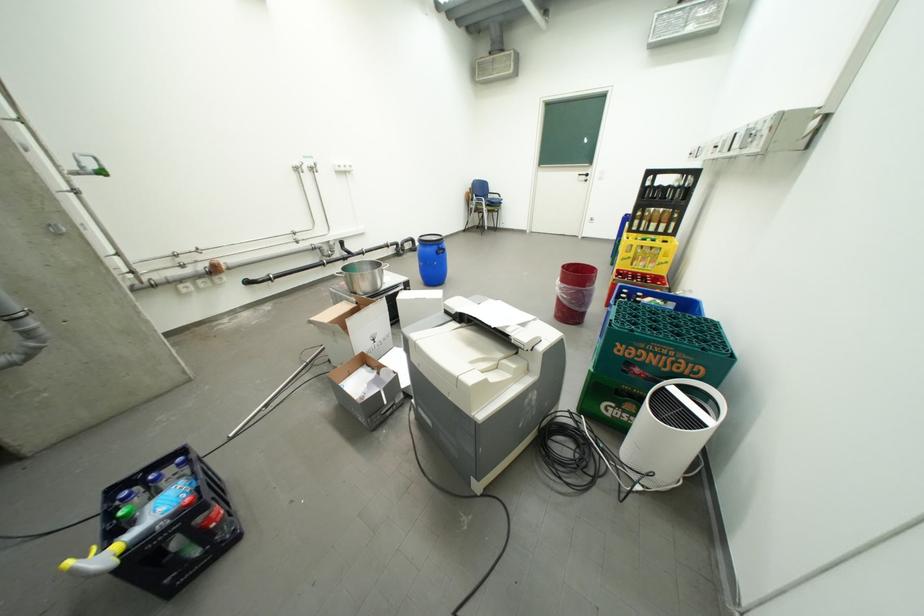
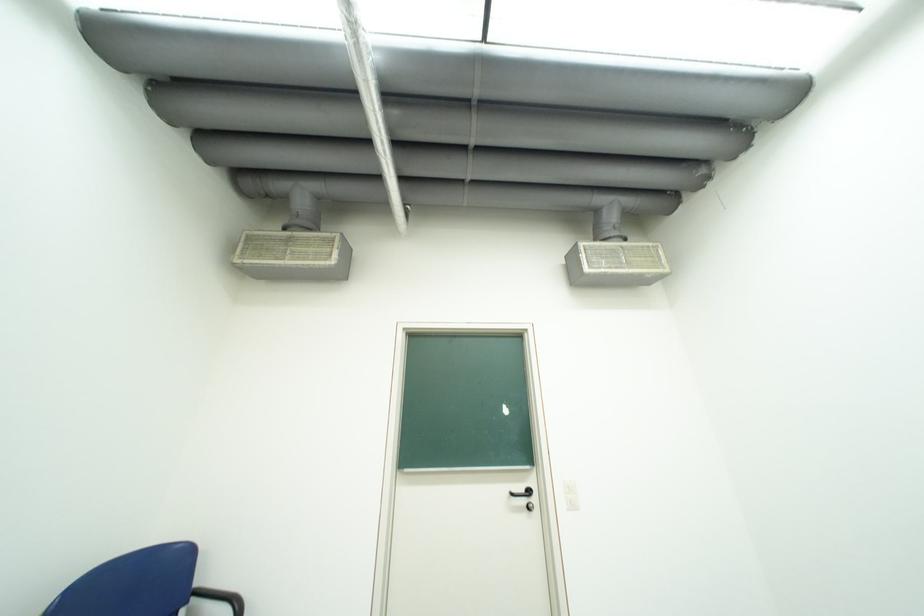
Where in the second image is the point corresponding to pixel 590 176 from the first image?

(523, 495)